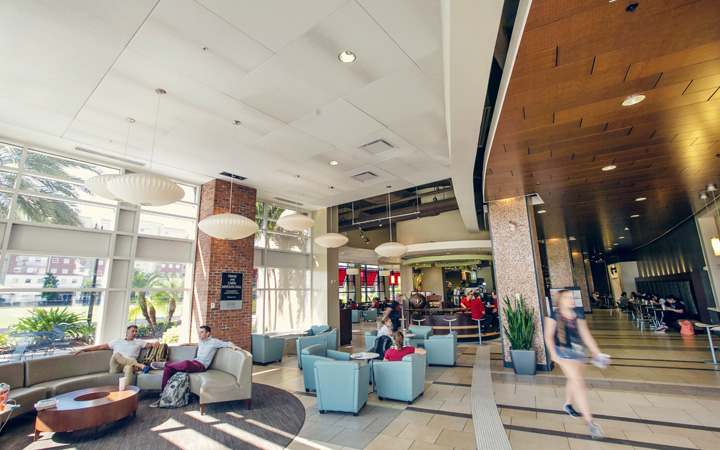
Where is `ceiling`? The image size is (720, 450). ceiling is located at coordinates (273, 96).